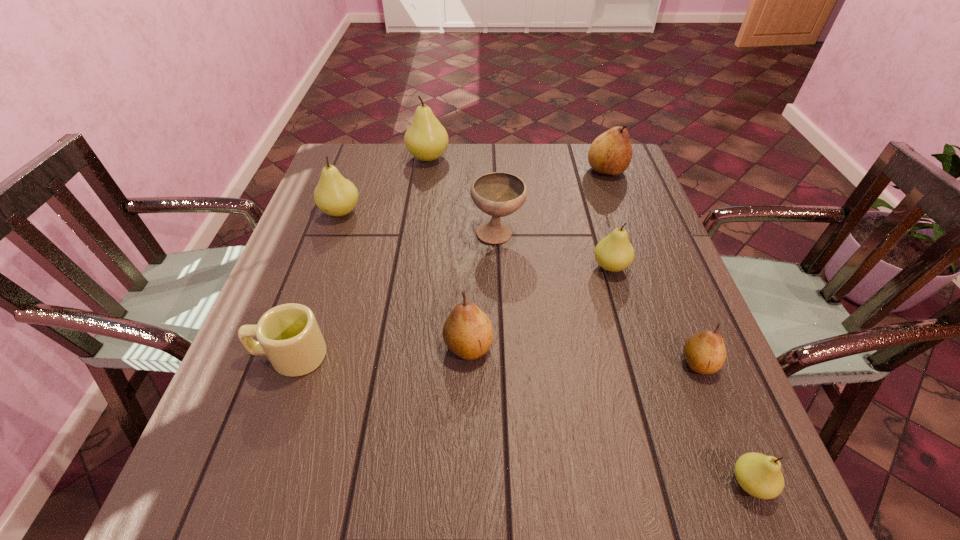
Find the location of a particular element. mug is located at coordinates (288, 334).

Locate an element on the screen. The image size is (960, 540). the smallest brown pear is located at coordinates (705, 352).

You are a GUI agent. You are given a task and a screenshot of the screen. Output one action in this format:
    pyautogui.click(x=<x>, y=<y>)
    Task: Click on the smallest green pear
    The image size is (960, 540).
    Given the screenshot: What is the action you would take?
    pyautogui.click(x=759, y=475)

Locate an element on the screen. This screenshot has width=960, height=540. the nearest object is located at coordinates (759, 475).

Where is `vacant area situated on the left of the sixth pear from right to left`? The image size is (960, 540). vacant area situated on the left of the sixth pear from right to left is located at coordinates (384, 158).

Where is `vacant space situated on the front of the farthest brown pear`? The image size is (960, 540). vacant space situated on the front of the farthest brown pear is located at coordinates click(628, 231).

Identify the location of vacant space located 0.080m on the right of the second biggest green pear. (392, 212).

Where is `free space located 0.170m on the back of the chalice`? This screenshot has width=960, height=540. free space located 0.170m on the back of the chalice is located at coordinates (495, 181).

Locate an element on the screen. The image size is (960, 540). free space located on the back of the second smallest brown pear is located at coordinates (470, 249).

I want to click on vacant space situated 0.190m on the front of the fifth farthest object, so click(635, 349).